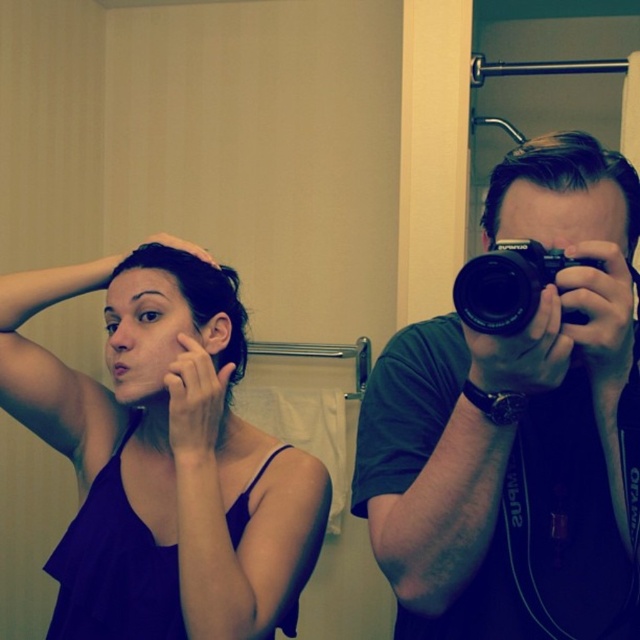
Question: Does black matte camera at right have a lesser width compared to purple matte tank top at upper left?

Choices:
 (A) yes
 (B) no

Answer: (A)

Question: Which point is closer to the camera?

Choices:
 (A) (392, 509)
 (B) (529, 316)

Answer: (B)

Question: Can you confirm if purple matte tank top at upper left is positioned above black plastic camera at center?

Choices:
 (A) yes
 (B) no

Answer: (B)

Question: Among these points, which one is farthest from the camera?

Choices:
 (A) (186, 323)
 (B) (412, 385)
 (C) (497, 250)

Answer: (A)

Question: Can you confirm if black matte camera at right is positioned to the left of purple matte tank top at upper left?

Choices:
 (A) no
 (B) yes

Answer: (A)

Question: Which of the following is the closest to the observer?

Choices:
 (A) purple matte tank top at upper left
 (B) black plastic camera at center

Answer: (B)